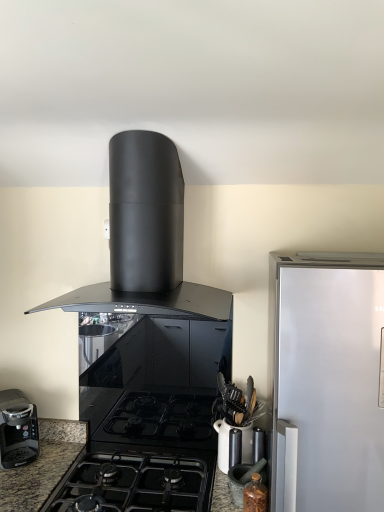
Question: Is matte black mortar and pestle at lower right, which is counted as the second kitchen appliance, starting from the bottom, closer to camera compared to black matte range hood at upper center, placed as the 4th kitchen appliance when sorted from bottom to top?

Choices:
 (A) no
 (B) yes

Answer: (A)

Question: Is black matte range hood at upper center, arranged as the second kitchen appliance when viewed from the left, located within matte black mortar and pestle at lower right, the third kitchen appliance when ordered from top to bottom?

Choices:
 (A) no
 (B) yes

Answer: (A)

Question: From a real-world perspective, is matte black mortar and pestle at lower right, the third kitchen appliance when ordered from top to bottom, physically below black matte range hood at upper center, placed as the 4th kitchen appliance when sorted from bottom to top?

Choices:
 (A) no
 (B) yes

Answer: (B)

Question: Does matte black mortar and pestle at lower right, placed as the 2th kitchen appliance when sorted from right to left, have a lesser height compared to black matte range hood at upper center, the first kitchen appliance from the top?

Choices:
 (A) yes
 (B) no

Answer: (A)

Question: Is matte black mortar and pestle at lower right, placed as the 3th kitchen appliance when sorted from left to right, at the left side of black matte range hood at upper center, placed as the 4th kitchen appliance when sorted from bottom to top?

Choices:
 (A) yes
 (B) no

Answer: (B)

Question: From a real-world perspective, is brown glass jar at lower right, the first kitchen appliance in the bottom-to-top sequence, physically located above or below black plastic coffee maker at lower left, which appears as the first kitchen appliance when viewed from the left?

Choices:
 (A) above
 (B) below

Answer: (B)

Question: Is brown glass jar at lower right, marked as the fourth kitchen appliance in a top-to-bottom arrangement, in front of or behind black plastic coffee maker at lower left, arranged as the 2th kitchen appliance when viewed from the top, in the image?

Choices:
 (A) front
 (B) behind

Answer: (A)

Question: In terms of width, does brown glass jar at lower right, which is the 1th kitchen appliance from right to left, look wider or thinner when compared to black plastic coffee maker at lower left, which appears as the first kitchen appliance when viewed from the left?

Choices:
 (A) wide
 (B) thin

Answer: (B)

Question: From the image's perspective, relative to black plastic coffee maker at lower left, which appears as the first kitchen appliance when viewed from the left, is brown glass jar at lower right, the first kitchen appliance in the bottom-to-top sequence, above or below?

Choices:
 (A) above
 (B) below

Answer: (B)

Question: Is black matte range hood at upper center, placed as the 4th kitchen appliance when sorted from bottom to top, wider or thinner than brown glass jar at lower right, acting as the 4th kitchen appliance starting from the left?

Choices:
 (A) wide
 (B) thin

Answer: (A)

Question: From a real-world perspective, is black matte range hood at upper center, which ranks as the 3th kitchen appliance in right-to-left order, above or below brown glass jar at lower right, the first kitchen appliance in the bottom-to-top sequence?

Choices:
 (A) below
 (B) above

Answer: (B)

Question: Relative to brown glass jar at lower right, which is the 1th kitchen appliance from right to left, is black matte range hood at upper center, placed as the 4th kitchen appliance when sorted from bottom to top, in front or behind?

Choices:
 (A) front
 (B) behind

Answer: (A)

Question: In terms of height, does black matte range hood at upper center, placed as the 4th kitchen appliance when sorted from bottom to top, look taller or shorter compared to brown glass jar at lower right, marked as the fourth kitchen appliance in a top-to-bottom arrangement?

Choices:
 (A) tall
 (B) short

Answer: (A)

Question: From their relative heights in the image, would you say black matte/glossy gas stove at center is taller or shorter than brown glass jar at lower right, acting as the 4th kitchen appliance starting from the left?

Choices:
 (A) tall
 (B) short

Answer: (B)

Question: In terms of width, does black matte/glossy gas stove at center look wider or thinner when compared to brown glass jar at lower right, which is the 1th kitchen appliance from right to left?

Choices:
 (A) thin
 (B) wide

Answer: (B)